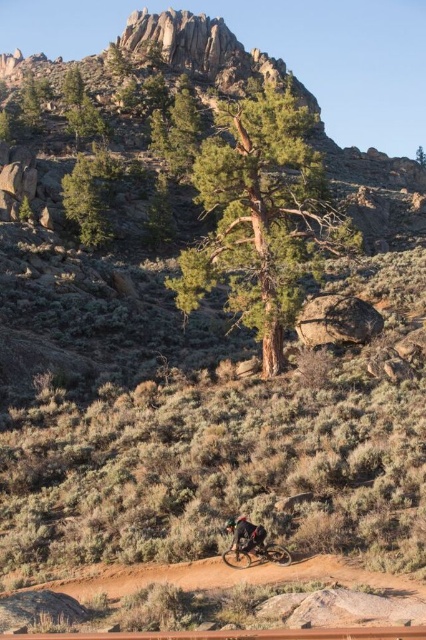
Looking at this image, you are planning a hiking trip and see the rugged granite mountain at upper center and the shiny metallic bicycle at lower center in the image. Based on their sizes in the image, which object would likely be farther away from you?

The rugged granite mountain at upper center is larger in the image compared to the shiny metallic bicycle at lower center. Since larger objects in a scene typically appear closer to the viewer, the rugged granite mountain at upper center is likely closer, and the shiny metallic bicycle at lower center is farther away. However, this contradicts the size comparison given. Wait, according to perspective, larger objects can be closer or farther depending on actual size. But the question is about which is likely